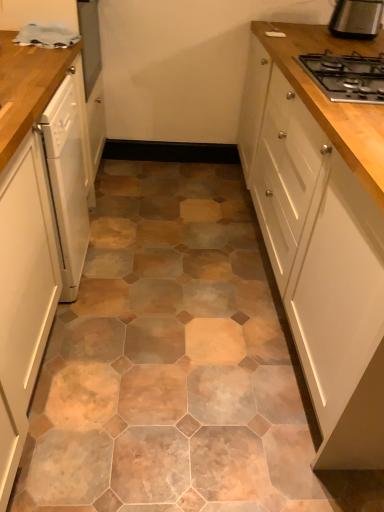
Question: Visually, is black metal gas stove at upper right positioned to the left or to the right of black metallic toaster at upper right?

Choices:
 (A) left
 (B) right

Answer: (A)

Question: Looking at their shapes, would you say black metal gas stove at upper right is wider or thinner than black metallic toaster at upper right?

Choices:
 (A) wide
 (B) thin

Answer: (A)

Question: Which object is the closest to the white glossy cabinet at left, the first cabinetry viewed from the left?

Choices:
 (A) white glossy cabinet at upper right, which is the 2th cabinetry from left to right
 (B) black metallic toaster at upper right
 (C) white glossy dishwasher at left
 (D) wooden at left
 (E) black metal gas stove at upper right

Answer: (D)

Question: Which is farther from the wooden at left?

Choices:
 (A) white glossy cabinet at left, the 2th cabinetry positioned from the right
 (B) white glossy dishwasher at left
 (C) black metallic toaster at upper right
 (D) black metal gas stove at upper right
 (E) white glossy cabinet at upper right, which is the 2th cabinetry from left to right

Answer: (C)